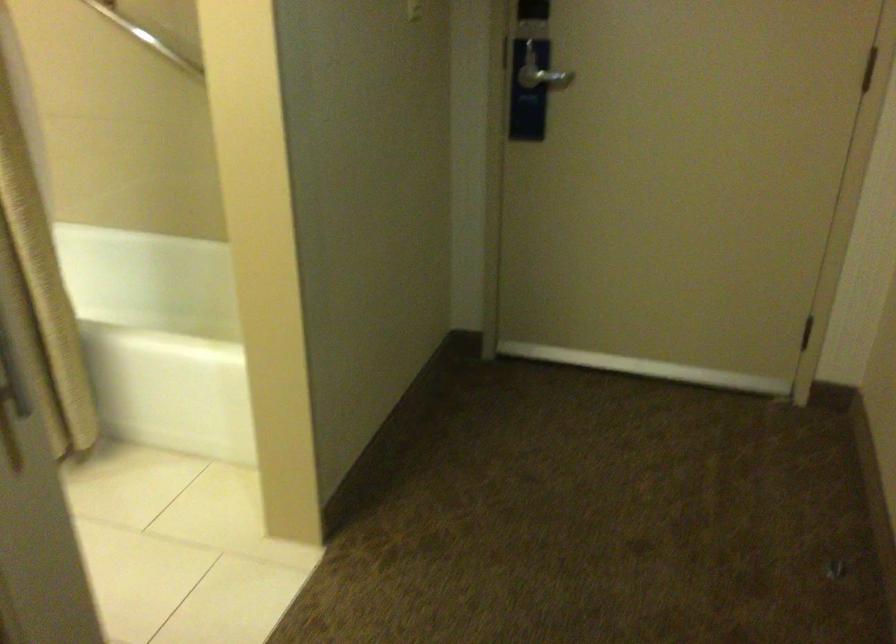
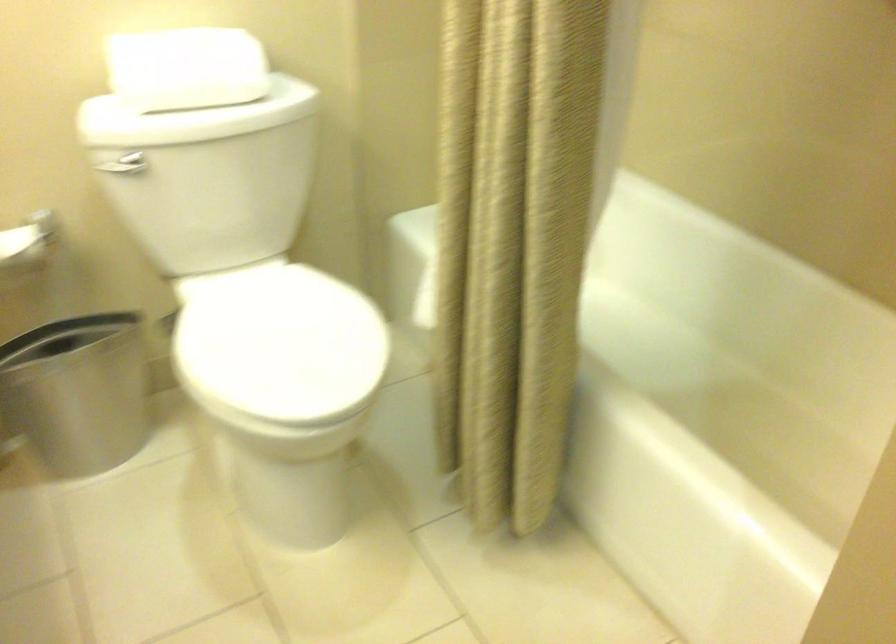
Question: Based on the continuous images, in which direction is the camera rotating? Reply with the corresponding letter.

Choices:
 (A) Left
 (B) Right
 (C) Up
 (D) Down

Answer: (A)